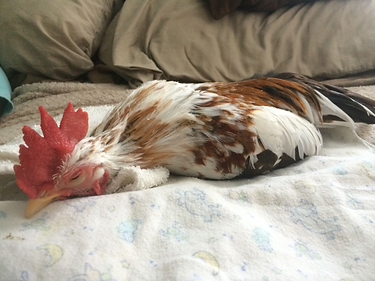
The width and height of the screenshot is (375, 281). I want to click on brown blanket, so click(79, 91).